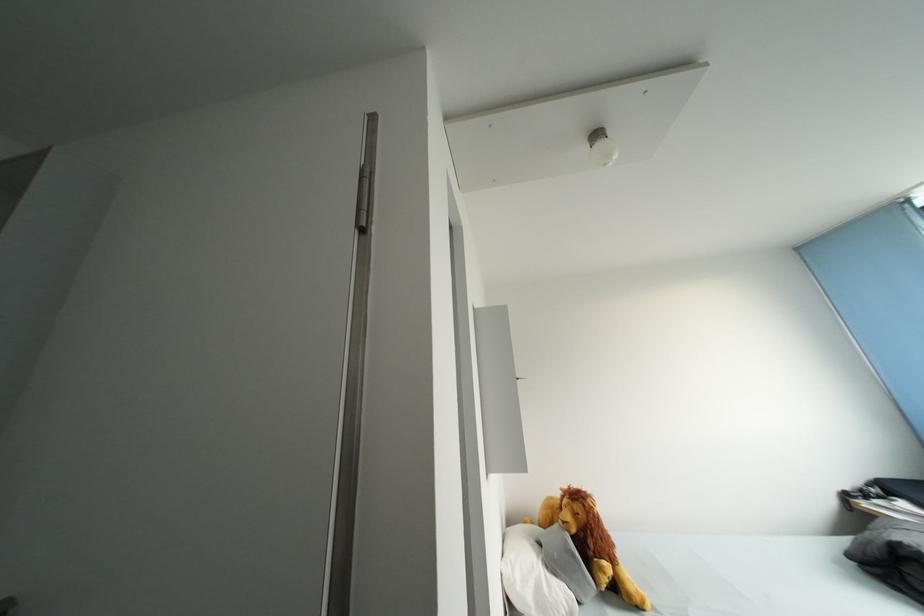
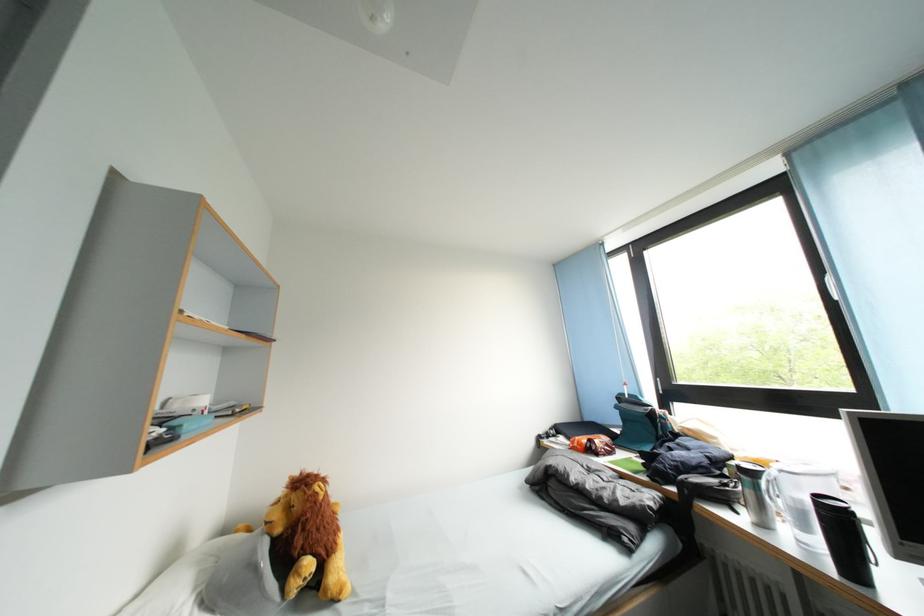
Question: The first image is from the beginning of the video and the second image is from the end. How did the camera likely rotate when shooting the video?

Choices:
 (A) Left
 (B) Right
 (C) Up
 (D) Down

Answer: (B)